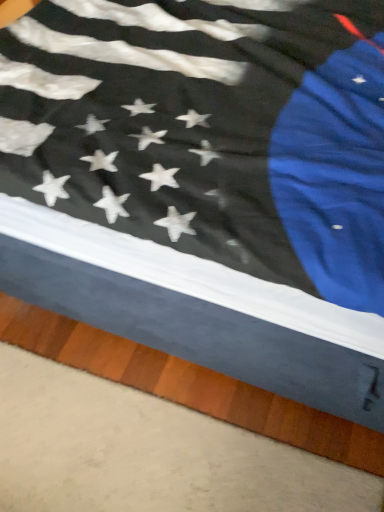
Question: Does smooth wood plank at lower right have a greater height compared to black matte flag at center?

Choices:
 (A) no
 (B) yes

Answer: (A)

Question: Is black matte flag at center located within smooth wood plank at lower right?

Choices:
 (A) no
 (B) yes

Answer: (A)

Question: Could you tell me if smooth wood plank at lower right is turned towards black matte flag at center?

Choices:
 (A) no
 (B) yes

Answer: (A)

Question: From a real-world perspective, is smooth wood plank at lower right physically below black matte flag at center?

Choices:
 (A) yes
 (B) no

Answer: (A)

Question: Does smooth wood plank at lower right touch black matte flag at center?

Choices:
 (A) no
 (B) yes

Answer: (A)

Question: From a real-world perspective, is smooth wood plank at lower right physically above black matte flag at center?

Choices:
 (A) yes
 (B) no

Answer: (B)

Question: Is black matte flag at center to the left of smooth wood plank at lower right from the viewer's perspective?

Choices:
 (A) no
 (B) yes

Answer: (A)

Question: Is black matte flag at center positioned with its back to smooth wood plank at lower right?

Choices:
 (A) no
 (B) yes

Answer: (A)

Question: Is black matte flag at center bigger than smooth wood plank at lower right?

Choices:
 (A) yes
 (B) no

Answer: (A)

Question: Does black matte flag at center have a lesser height compared to smooth wood plank at lower right?

Choices:
 (A) no
 (B) yes

Answer: (A)

Question: Would you say black matte flag at center contains smooth wood plank at lower right?

Choices:
 (A) yes
 (B) no

Answer: (B)

Question: Does black matte flag at center have a greater width compared to smooth wood plank at lower right?

Choices:
 (A) yes
 (B) no

Answer: (A)

Question: Is smooth wood plank at lower right bigger or smaller than black matte flag at center?

Choices:
 (A) big
 (B) small

Answer: (B)